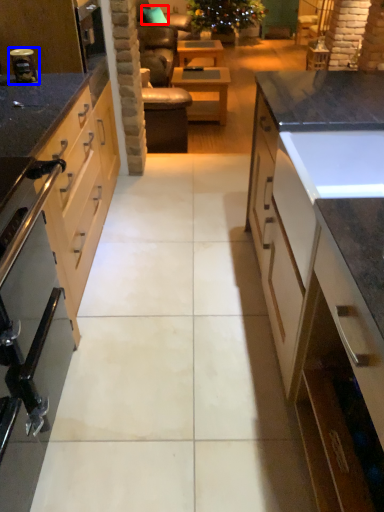
Question: Which of the following is the closest to the observer, pillow (highlighted by a red box) or appliance (highlighted by a blue box)?

Choices:
 (A) pillow
 (B) appliance

Answer: (B)